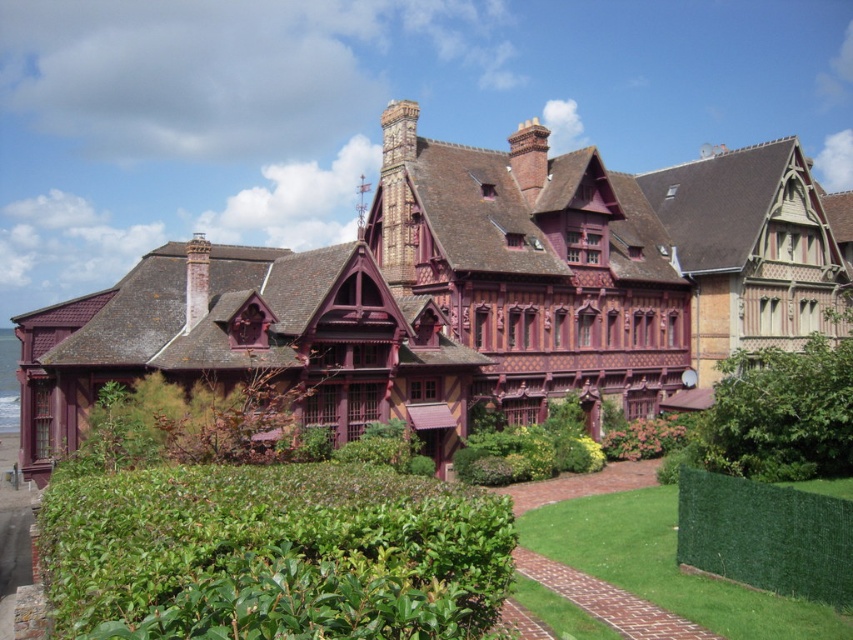
Can you confirm if wooden mansion at center is positioned to the right of green leafy hedge at center right?

In fact, wooden mansion at center is to the left of green leafy hedge at center right.

Based on the photo, between wooden mansion at center and green leafy hedge at center right, which one has less height?

green leafy hedge at center right

Find the location of `wooden mansion at center`. wooden mansion at center is located at coordinates (473, 289).

Does wooden mansion at center have a lesser width compared to green artificial hedge at lower right?

No.

Can you confirm if wooden mansion at center is bigger than green artificial hedge at lower right?

Indeed, wooden mansion at center has a larger size compared to green artificial hedge at lower right.

Locate an element on the screen. wooden mansion at center is located at coordinates (473, 289).

Is green leafy hedge at center right shorter than green artificial hedge at lower right?

No.

Is green leafy hedge at center right positioned in front of green artificial hedge at lower right?

That is False.

I want to click on green leafy hedge at center right, so click(781, 412).